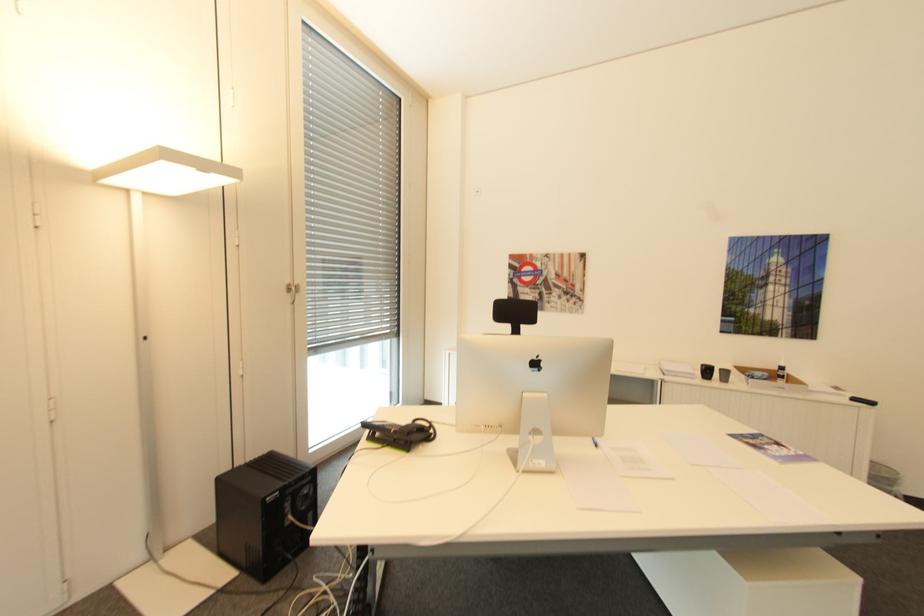
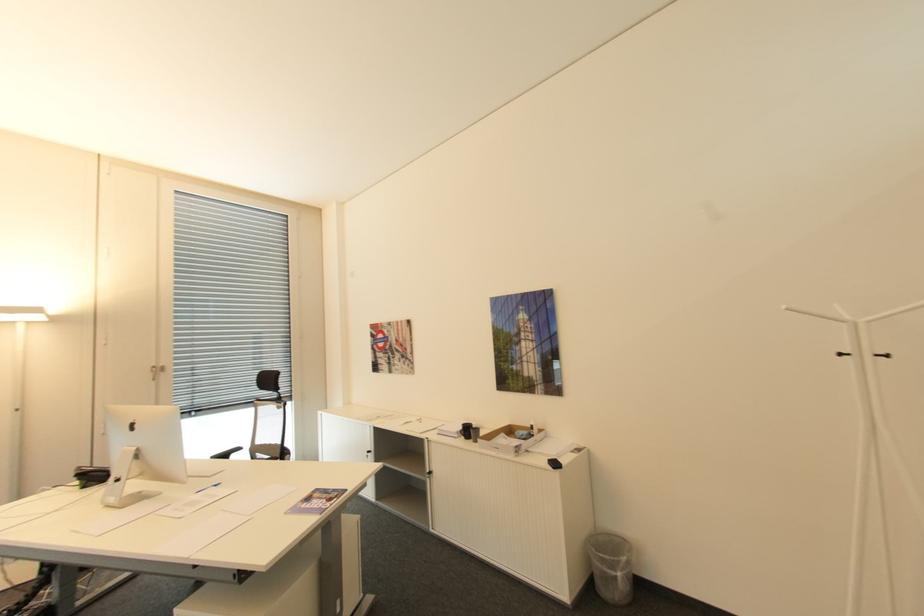
Locate, in the second image, the point that corresponds to (x=548, y=365) in the first image.

(140, 426)